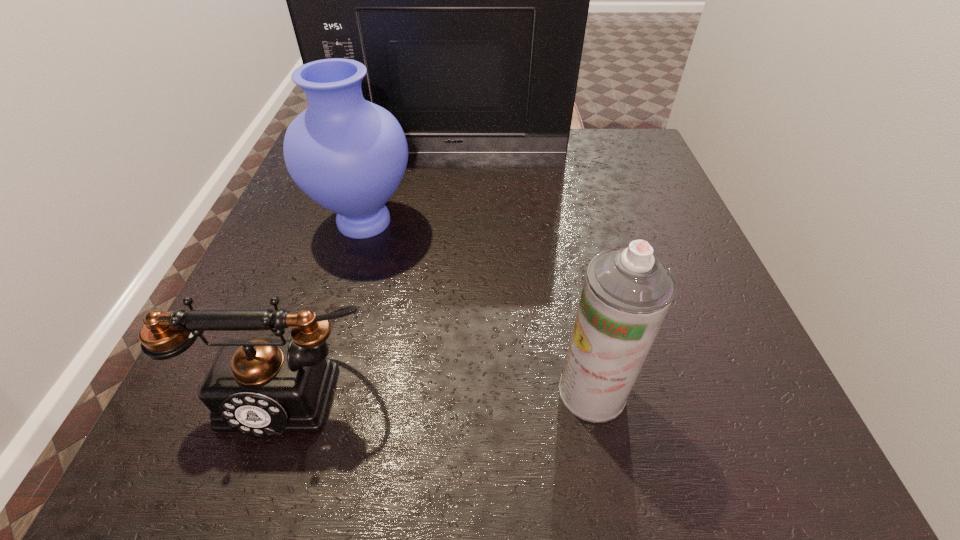
The image size is (960, 540). Identify the location of the tallest object. (468, 0).

Find the location of a particular element. the farthest object is located at coordinates (468, 0).

Where is `the second farthest object`? the second farthest object is located at coordinates (349, 155).

In order to click on aerosol can in this screenshot , I will do `click(627, 292)`.

In order to click on the shortest object in this screenshot , I will do `click(262, 386)`.

I want to click on vacant space situated 0.370m on the front panel of the tallest object, so click(x=437, y=261).

Locate an element on the screen. Image resolution: width=960 pixels, height=540 pixels. vacant region located on the back of the second farthest object is located at coordinates (382, 159).

You are a GUI agent. You are given a task and a screenshot of the screen. Output one action in this format:
    pyautogui.click(x=<x>, y=<y>)
    Task: Click on the free region located 0.360m on the back of the aerosol can
    The width and height of the screenshot is (960, 540).
    Given the screenshot: What is the action you would take?
    pyautogui.click(x=557, y=213)

Image resolution: width=960 pixels, height=540 pixels. I want to click on object located at the far edge, so click(x=468, y=0).

Image resolution: width=960 pixels, height=540 pixels. I want to click on aerosol can at the near edge, so pyautogui.click(x=627, y=292).